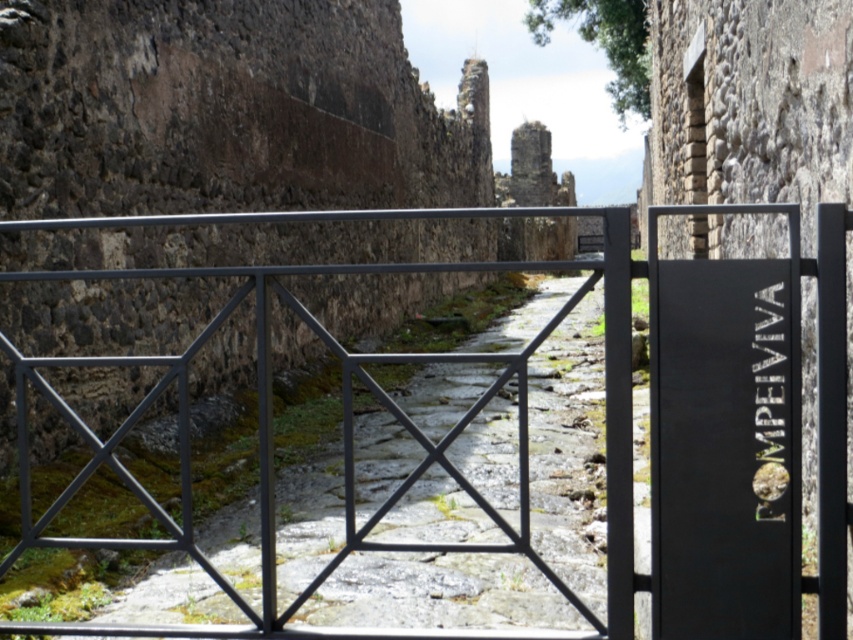
Between black metal gate at center and black matte sign at right, which one has more height?

Standing taller between the two is black metal gate at center.

Is the position of black metal gate at center more distant than that of black matte sign at right?

That is False.

Who is more distant from viewer, (795, 515) or (698, 381)?

The point (698, 381) is behind.

At what (x,y) coordinates should I click in order to perform the action: click on black metal gate at center. Please return your answer as a coordinate pair (x, y). Looking at the image, I should click on (605, 417).